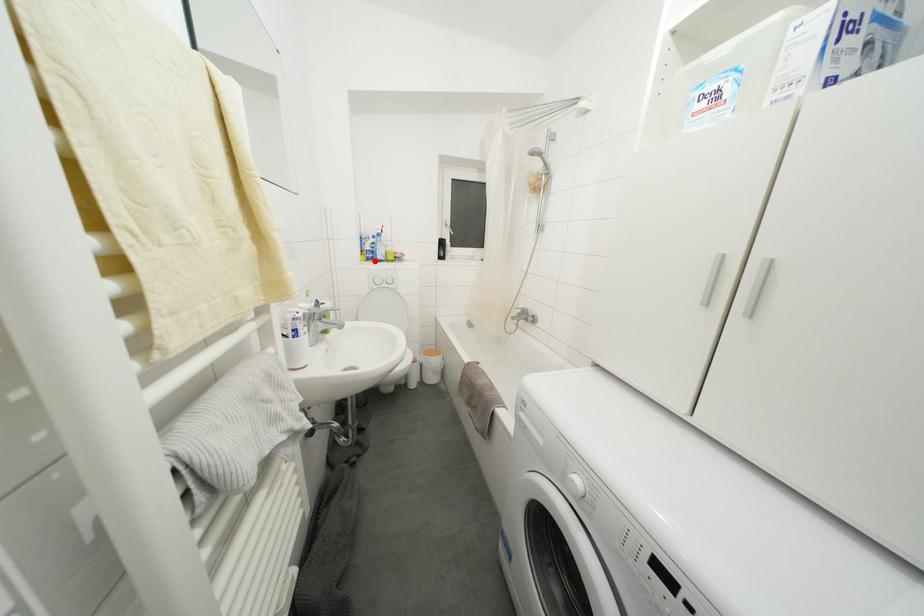
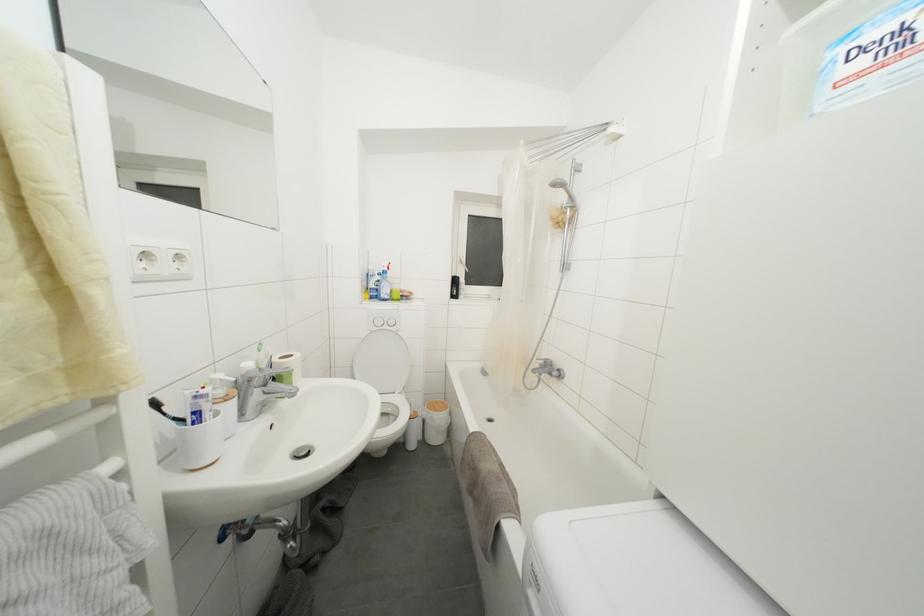
The point at the highlighted location is marked in the first image. Where is the corresponding point in the second image?

(379, 300)